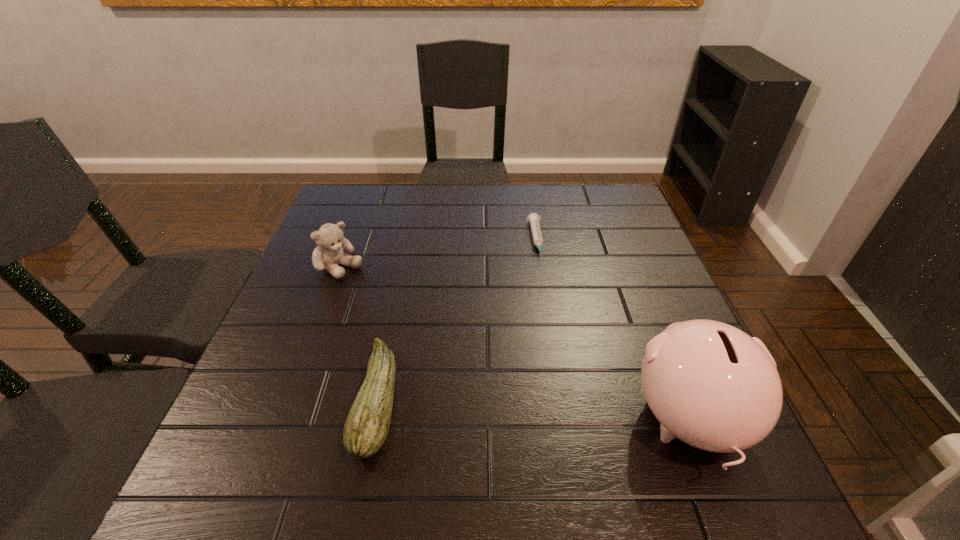
Select which object appears as the third closest to the syringe. Please provide its 2D coordinates. Your answer should be formatted as a tuple, i.e. [(x, y)], where the tuple contains the x and y coordinates of a point satisfying the conditions above.

[(330, 239)]

This screenshot has height=540, width=960. Identify the location of object that stands as the closest to the syringe. (709, 384).

The image size is (960, 540). Identify the location of vacant position in the image that satisfies the following two spatial constraints: 1. on the front side of the teddy bear; 2. at the stem end of the third object from right to left. (290, 399).